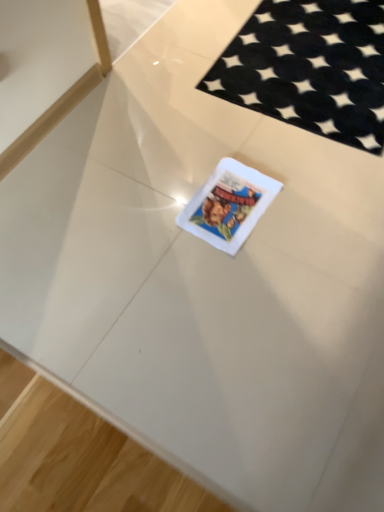
Question: Does white matte card at center have a larger size compared to black felt mat at upper right?

Choices:
 (A) yes
 (B) no

Answer: (B)

Question: Is white matte card at center facing towards black felt mat at upper right?

Choices:
 (A) yes
 (B) no

Answer: (B)

Question: Does white matte card at center have a greater height compared to black felt mat at upper right?

Choices:
 (A) no
 (B) yes

Answer: (B)

Question: Does white matte card at center have a smaller size compared to black felt mat at upper right?

Choices:
 (A) no
 (B) yes

Answer: (B)

Question: Is white matte card at center thinner than black felt mat at upper right?

Choices:
 (A) no
 (B) yes

Answer: (B)

Question: Can you see white matte card at center touching black felt mat at upper right?

Choices:
 (A) no
 (B) yes

Answer: (A)

Question: Does black felt mat at upper right have a lesser height compared to white matte card at center?

Choices:
 (A) no
 (B) yes

Answer: (B)

Question: Does black felt mat at upper right appear on the left side of white matte card at center?

Choices:
 (A) yes
 (B) no

Answer: (B)

Question: Is black felt mat at upper right outside of white matte card at center?

Choices:
 (A) yes
 (B) no

Answer: (A)

Question: Does black felt mat at upper right have a lesser width compared to white matte card at center?

Choices:
 (A) no
 (B) yes

Answer: (A)

Question: Could you tell me if black felt mat at upper right is facing white matte card at center?

Choices:
 (A) yes
 (B) no

Answer: (A)

Question: Does black felt mat at upper right have a larger size compared to white matte card at center?

Choices:
 (A) yes
 (B) no

Answer: (A)

Question: In the image, is black felt mat at upper right positioned in front of or behind white matte card at center?

Choices:
 (A) front
 (B) behind

Answer: (B)